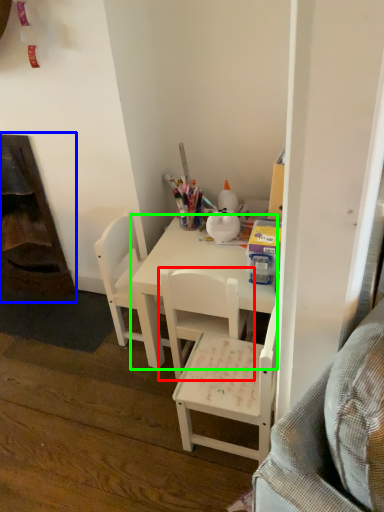
Question: Which object is the farthest from chair (highlighted by a red box)? Choose among these: fireplace (highlighted by a blue box) or desk (highlighted by a green box).

Choices:
 (A) fireplace
 (B) desk

Answer: (A)